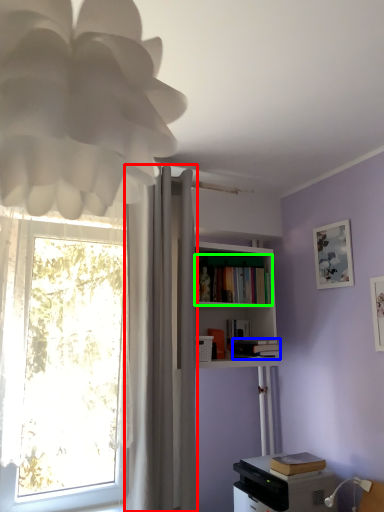
Question: Which object is positioned farthest from curtain (highlighted by a red box)? Select from book (highlighted by a blue box) and book (highlighted by a green box).

Choices:
 (A) book
 (B) book

Answer: (A)